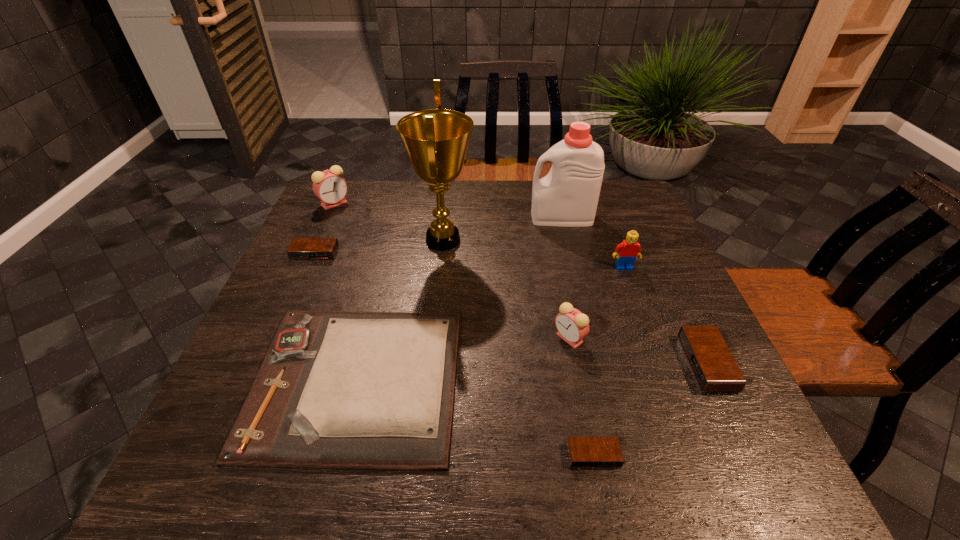
You are a GUI agent. You are given a task and a screenshot of the screen. Output one action in this format:
    pyautogui.click(x=<x>, y=<y>)
    Task: Click on the award that is at the far edge
    The height and width of the screenshot is (540, 960).
    Given the screenshot: What is the action you would take?
    pyautogui.click(x=436, y=140)

The width and height of the screenshot is (960, 540). In order to click on detergent that is positioned at the far edge in this screenshot , I will do `click(567, 196)`.

At what (x,y) coordinates should I click in order to perform the action: click on alarm clock that is positioned at the far edge. Please return your answer as a coordinate pair (x, y). This screenshot has width=960, height=540. Looking at the image, I should click on (329, 186).

Identify the location of clipboard that is at the near edge. This screenshot has width=960, height=540. (366, 390).

What are the coordinates of `alarm clock at the near edge` in the screenshot? It's located at (584, 452).

Find the location of a particular element. clipboard located at the left edge is located at coordinates (366, 390).

Where is `Lego that is at the right edge`? This screenshot has height=540, width=960. Lego that is at the right edge is located at coordinates (627, 251).

The width and height of the screenshot is (960, 540). Identify the location of alarm clock located at the right edge. (714, 367).

Where is `object present at the far left corner`? This screenshot has width=960, height=540. object present at the far left corner is located at coordinates (329, 186).

Locate an element on the screen. The height and width of the screenshot is (540, 960). object that is at the near left corner is located at coordinates (366, 390).